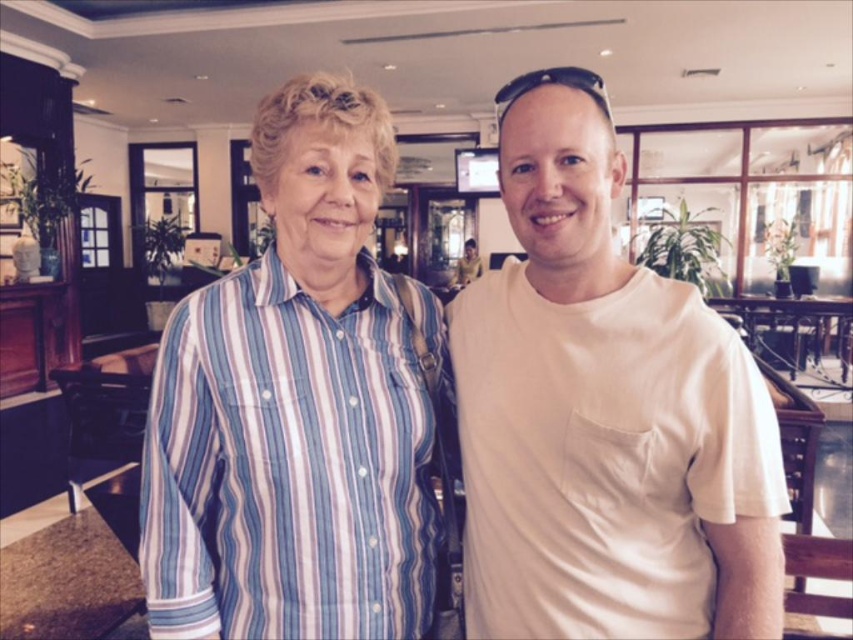
Question: Can you confirm if white matte t-shirt at center is wider than blue striped shirt at center?

Choices:
 (A) no
 (B) yes

Answer: (B)

Question: Which point is farther from the camera taking this photo?

Choices:
 (A) (251, 272)
 (B) (753, 472)

Answer: (A)

Question: Can you confirm if white matte t-shirt at center is positioned to the right of blue striped shirt at center?

Choices:
 (A) no
 (B) yes

Answer: (B)

Question: Among these points, which one is farthest from the camera?

Choices:
 (A) (206, 362)
 (B) (676, 374)

Answer: (A)

Question: From the image, what is the correct spatial relationship of white matte t-shirt at center in relation to blue striped shirt at center?

Choices:
 (A) above
 (B) below

Answer: (B)